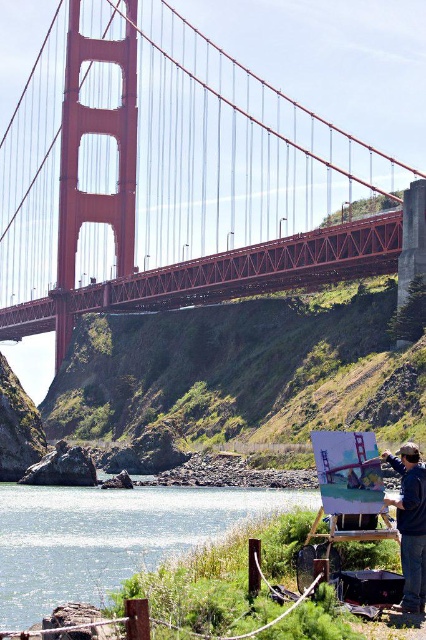
Question: Observing the image, what is the correct spatial positioning of clear water at lower left in reference to dark blue fabric at lower right?

Choices:
 (A) below
 (B) above

Answer: (A)

Question: Which of the following is the closest to the observer?

Choices:
 (A) red painted steel suspension bridge at center
 (B) clear water at lower left

Answer: (B)

Question: Can you confirm if clear water at lower left is positioned below dark blue fabric at lower right?

Choices:
 (A) no
 (B) yes

Answer: (B)

Question: Which point is closer to the camera?

Choices:
 (A) clear water at lower left
 (B) dark blue fabric at lower right

Answer: (B)

Question: Which point is closer to the camera taking this photo?

Choices:
 (A) (77, 108)
 (B) (409, 481)
 (C) (48, 611)

Answer: (B)

Question: Can you confirm if red painted steel suspension bridge at center is positioned to the right of dark blue fabric at lower right?

Choices:
 (A) yes
 (B) no

Answer: (B)